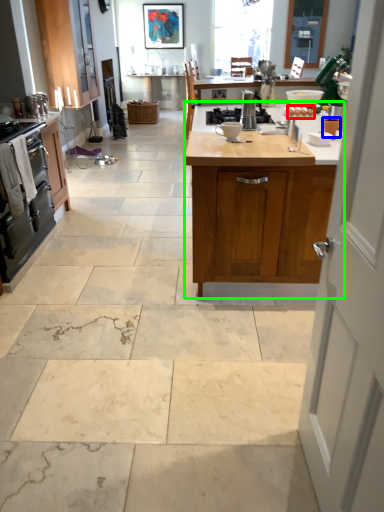
Question: Which is farther away from food (highlighted by a red box)? appliance (highlighted by a blue box) or cabinetry (highlighted by a green box)?

Choices:
 (A) appliance
 (B) cabinetry

Answer: (B)